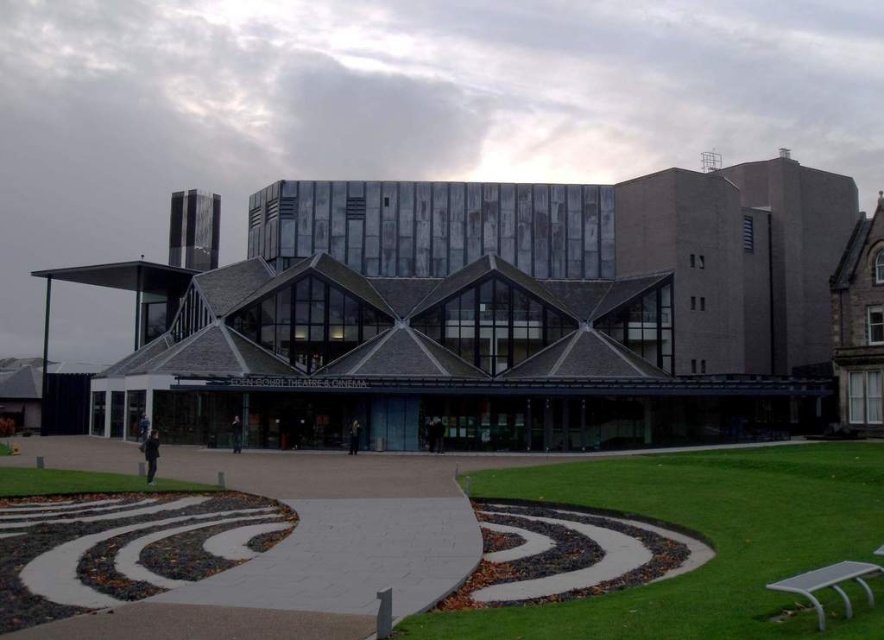
Question: Estimate the real-world distances between objects in this image. Which object is closer to the green grass at lower left?

Choices:
 (A) dark gray concrete building at center
 (B) green grass at center

Answer: (B)

Question: Among these points, which one is farthest from the camera?

Choices:
 (A) (878, 492)
 (B) (29, 468)
 (C) (616, 392)

Answer: (C)

Question: Where is green grass at center located in relation to green grass at lower left in the image?

Choices:
 (A) above
 (B) below

Answer: (A)

Question: Does dark gray concrete building at center appear over green grass at center?

Choices:
 (A) yes
 (B) no

Answer: (A)

Question: Is dark gray concrete building at center smaller than green grass at lower left?

Choices:
 (A) no
 (B) yes

Answer: (A)

Question: Estimate the real-world distances between objects in this image. Which object is farther from the dark gray concrete building at center?

Choices:
 (A) green grass at lower left
 (B) green grass at center

Answer: (A)